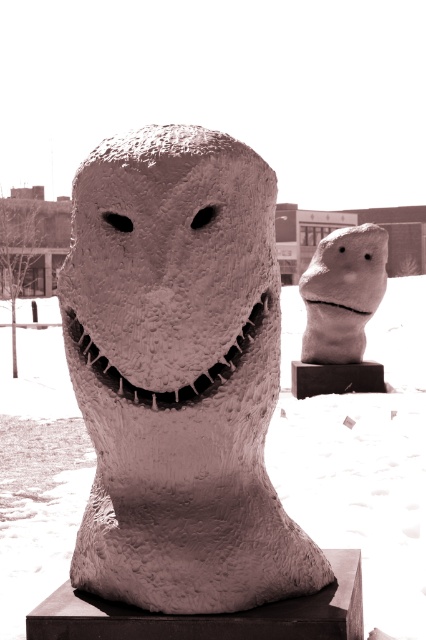
You are standing in the snowy area and want to take a photo of the fuzzy textured sculpture at center without the fuzzy white snow at center appearing in the frame. Is this possible based on their positions?

The fuzzy white snow at center is below the fuzzy textured sculpture at center, so if you position yourself to capture the sculpture from above or adjust your angle to exclude the area beneath it, you can avoid including the fuzzy white snow at center in your photo.

You are an art curator planning to install these two sculptures in a gallery. The textured stone head at center and the white matte stone head at center need to be arranged so that the taller one is placed in the back for better visibility. Which sculpture should be placed in the back?

The white matte stone head at center should be placed in the back because it is taller than the textured stone head at center.